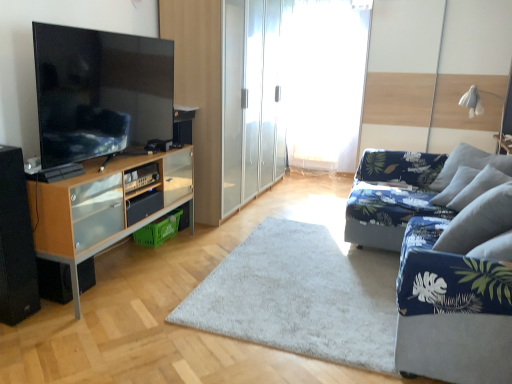
Measure the distance between white soft rug at center and camera.

white soft rug at center is 2.13 meters away from camera.

Where is `white soft rug at center`? white soft rug at center is located at coordinates (301, 296).

Identify the location of wooden cabinet at left. (103, 207).

Where is `black matte speaker at lower left, the 2th speaker when ordered from back to front`? black matte speaker at lower left, the 2th speaker when ordered from back to front is located at coordinates (16, 242).

Find the location of a particular element. The width and height of the screenshot is (512, 384). white sheer curtain at center is located at coordinates (325, 83).

What do you see at coordinates (100, 92) in the screenshot? I see `matte black tv at left` at bounding box center [100, 92].

In order to face blue fabric couch at right, should I rotate leftwards or rightwards?

Rotate your view right by about 26.992°.

Locate an element on the screen. Image resolution: width=512 pixels, height=384 pixels. gray fabric pillow at right is located at coordinates (478, 221).

How much distance is there between gray fabric pillow at right and black matte speaker at lower left, the 2th speaker when ordered from back to front?

gray fabric pillow at right and black matte speaker at lower left, the 2th speaker when ordered from back to front, are 2.38 meters apart from each other.

In the image, is gray fabric pillow at right on the left side or the right side of black matte speaker at lower left, the 2th speaker when ordered from back to front?

Clearly, gray fabric pillow at right is on the right of black matte speaker at lower left, the 2th speaker when ordered from back to front, in the image.

Which point is more distant from viewer, (488, 190) or (12, 174)?

The point (488, 190) is farther.

From the image's perspective, is gray fabric pillow at right located beneath black matte speaker at lower left, the 2th speaker when ordered from back to front?

No.

From the image's perspective, between wooden cabinet at left and white sheer curtain at center, which one is located above?

white sheer curtain at center is shown above in the image.

Which object is thinner, wooden cabinet at left or white sheer curtain at center?

white sheer curtain at center.

Does wooden cabinet at left come in front of white sheer curtain at center?

Yes.

Does wooden cabinet at left have a smaller size compared to white sheer curtain at center?

Correct, wooden cabinet at left occupies less space than white sheer curtain at center.

At what (x,y) coordinates should I click in order to perform the action: click on screen door above the matte black tv at left (from the image's perspective). Please return your answer as a coordinate pair (x, y). Looking at the image, I should click on (251, 100).

From a real-world perspective, is transparent glass wardrobe at center positioned under matte black tv at left based on gravity?

Yes, from a real-world perspective, transparent glass wardrobe at center is below matte black tv at left.

Considering the relative sizes of transparent glass wardrobe at center and matte black tv at left in the image provided, is transparent glass wardrobe at center smaller than matte black tv at left?

No, transparent glass wardrobe at center is not smaller than matte black tv at left.

What's the angular difference between transparent glass wardrobe at center and matte black tv at left's facing directions?

The facing directions of transparent glass wardrobe at center and matte black tv at left are 1.23 degrees apart.

From a real-world perspective, is black matte speaker at lower left, the 2th speaker when ordered from back to front, above or below blue fabric couch at right?

black matte speaker at lower left, the 2th speaker when ordered from back to front, is above blue fabric couch at right.

Is black matte speaker at lower left, the 2th speaker when ordered from back to front, directly adjacent to blue fabric couch at right?

They are not placed beside each other.

From the image's perspective, is black matte speaker at lower left, the first speaker when ordered from front to back, above or below blue fabric couch at right?

black matte speaker at lower left, the first speaker when ordered from front to back, is above blue fabric couch at right.

Is wooden cabinet at left looking in the opposite direction of white soft rug at center?

wooden cabinet at left does not have its back to white soft rug at center.

From their relative heights in the image, would you say wooden cabinet at left is taller or shorter than white soft rug at center?

Clearly, wooden cabinet at left is taller compared to white soft rug at center.

Is wooden cabinet at left spatially inside white soft rug at center, or outside of it?

wooden cabinet at left exists outside the volume of white soft rug at center.

From the picture: Can you tell me how much wooden cabinet at left and white soft rug at center differ in facing direction?

There is a 178-degree angle between the facing directions of wooden cabinet at left and white soft rug at center.

Looking at the image, does wooden cabinet at left seem bigger or smaller compared to black matte speaker at lower left, the first speaker when ordered from front to back?

wooden cabinet at left is bigger than black matte speaker at lower left, the first speaker when ordered from front to back.

Is wooden cabinet at left positioned far away from black matte speaker at lower left, the first speaker when ordered from front to back?

No, wooden cabinet at left is not far from black matte speaker at lower left, the first speaker when ordered from front to back.

Is wooden cabinet at left not within black matte speaker at lower left, the first speaker when ordered from front to back?

That's correct, wooden cabinet at left is outside of black matte speaker at lower left, the first speaker when ordered from front to back.

From their relative heights in the image, would you say black matte speaker at lower left, which is counted as the 2th speaker, starting from the front, is taller or shorter than black matte speaker at lower left, the first speaker when ordered from front to back?

Considering their sizes, black matte speaker at lower left, which is counted as the 2th speaker, starting from the front, has less height than black matte speaker at lower left, the first speaker when ordered from front to back.

How different are the orientations of black matte speaker at lower left, marked as the first speaker in a back-to-front arrangement, and black matte speaker at lower left, the first speaker when ordered from front to back, in degrees?

1.44 degrees separate the facing orientations of black matte speaker at lower left, marked as the first speaker in a back-to-front arrangement, and black matte speaker at lower left, the first speaker when ordered from front to back.

In terms of size, does black matte speaker at lower left, marked as the first speaker in a back-to-front arrangement, appear bigger or smaller than black matte speaker at lower left, the 2th speaker when ordered from back to front?

In the image, black matte speaker at lower left, marked as the first speaker in a back-to-front arrangement, appears to be smaller than black matte speaker at lower left, the 2th speaker when ordered from back to front.

Which speaker is the 2nd one when counting from the left side of the gray fabric pillow at right? Please provide its 2D coordinates.

[(16, 242)]

There is a wooden cabinet at left. Identify the location of window screen above it (from a real-world perspective). This screenshot has height=384, width=512. (325, 83).

From the image, which object appears to be farther from white soft rug at center, wooden cabinet at left or blue fabric couch at right?

Among the two, wooden cabinet at left is located further to white soft rug at center.

Which object lies nearer to the anchor point transparent glass wardrobe at center, matte black tv at left or white sheer curtain at center?

The object closer to transparent glass wardrobe at center is white sheer curtain at center.

Which object lies further to the anchor point wooden cabinet at left, white sheer curtain at center or matte black tv at left?

white sheer curtain at center is further to wooden cabinet at left.

Considering their positions, is wooden cabinet at left positioned further to white soft rug at center than transparent glass wardrobe at center?

transparent glass wardrobe at center is positioned further to the anchor white soft rug at center.

Which object lies further to the anchor point black matte speaker at lower left, which is counted as the 2th speaker, starting from the front, white sheer curtain at center or gray fabric pillow at right?

The object further to black matte speaker at lower left, which is counted as the 2th speaker, starting from the front, is white sheer curtain at center.

In the scene shown: Looking at the image, which one is located further to white sheer curtain at center, white soft rug at center or black matte speaker at lower left, the first speaker when ordered from front to back?

Among the two, black matte speaker at lower left, the first speaker when ordered from front to back, is located further to white sheer curtain at center.

When comparing their distances from white sheer curtain at center, does wooden cabinet at left or black matte speaker at lower left, which is counted as the 2th speaker, starting from the front, seem closer?

wooden cabinet at left lies closer to white sheer curtain at center than the other object.

From the image, which object appears to be nearer to white soft rug at center, wooden cabinet at left or white sheer curtain at center?

wooden cabinet at left is closer to white soft rug at center.

Locate an element on the screen. This screenshot has width=512, height=384. studio couch between white soft rug at center and gray fabric pillow at right is located at coordinates tap(449, 270).

Identify the location of cabinetry between black matte speaker at lower left, the first speaker when ordered from front to back, and white soft rug at center, in the horizontal direction. (103, 207).

I want to click on plain situated between wooden cabinet at left and blue fabric couch at right from left to right, so click(x=301, y=296).

At what (x,y) coordinates should I click in order to perform the action: click on cabinetry located between blue fabric couch at right and white sheer curtain at center in the depth direction. Please return your answer as a coordinate pair (x, y). This screenshot has height=384, width=512. Looking at the image, I should click on (103, 207).